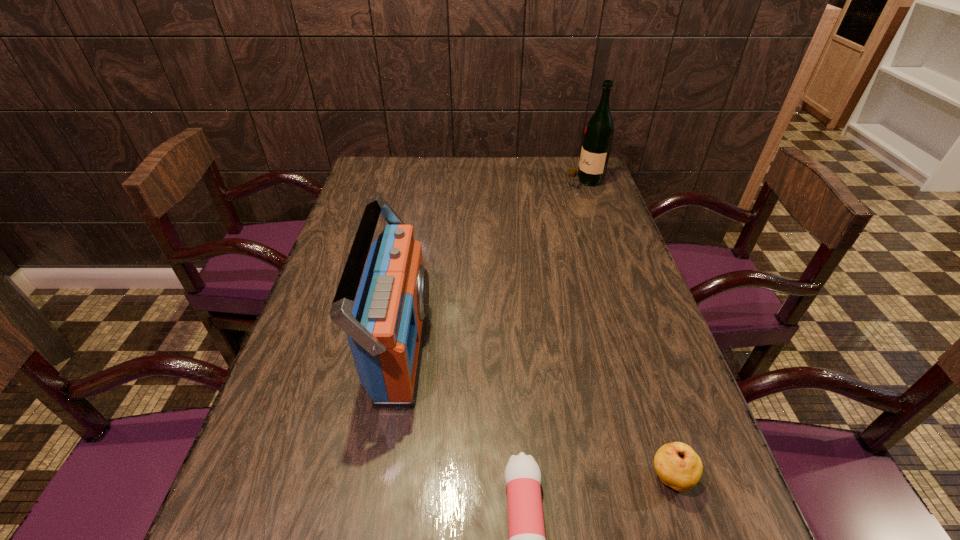
At what (x,y) coordinates should I click in order to perform the action: click on wine bottle positioned at the right edge. Please return your answer as a coordinate pair (x, y). Looking at the image, I should click on (598, 135).

What are the coordinates of `pear that is positioned at the right edge` in the screenshot? It's located at coord(678,466).

You are a GUI agent. You are given a task and a screenshot of the screen. Output one action in this format:
    pyautogui.click(x=<x>, y=<y>)
    Task: Click on the object present at the far right corner
    
    Given the screenshot: What is the action you would take?
    pyautogui.click(x=598, y=135)

The height and width of the screenshot is (540, 960). I want to click on vacant space at the far edge of the desktop, so click(x=428, y=173).

The height and width of the screenshot is (540, 960). Identify the location of vacant space at the left edge of the desktop. (320, 443).

In the image, there is a desktop. At what (x,y) coordinates should I click in order to perform the action: click on free region at the right edge. Please return your answer as a coordinate pair (x, y). Looking at the image, I should click on (715, 535).

Locate an element on the screen. This screenshot has width=960, height=540. vacant space at the far left corner of the desktop is located at coordinates (388, 166).

Where is `free point at the far right corner`? free point at the far right corner is located at coordinates (567, 159).

Locate an element on the screen. free space that is in between the leftmost object and the farthest object is located at coordinates (492, 264).

Locate an element on the screen. This screenshot has height=540, width=960. empty space between the leftmost object and the third tallest object is located at coordinates (536, 412).